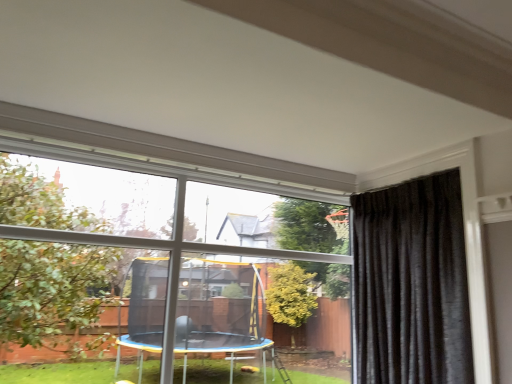
Question: From a real-world perspective, is black velvet curtain at right positioned above or below clear glass window at center?

Choices:
 (A) below
 (B) above

Answer: (B)

Question: In the image, is black velvet curtain at right positioned in front of or behind clear glass window at center?

Choices:
 (A) behind
 (B) front

Answer: (A)

Question: Considering the positions of black velvet curtain at right and clear glass window at center in the image, is black velvet curtain at right bigger or smaller than clear glass window at center?

Choices:
 (A) big
 (B) small

Answer: (B)

Question: In the image, is clear glass window at center positioned in front of or behind black velvet curtain at right?

Choices:
 (A) front
 (B) behind

Answer: (A)

Question: Visually, is clear glass window at center positioned to the left or to the right of black velvet curtain at right?

Choices:
 (A) left
 (B) right

Answer: (A)

Question: Based on their sizes in the image, would you say clear glass window at center is bigger or smaller than black velvet curtain at right?

Choices:
 (A) small
 (B) big

Answer: (B)

Question: From a real-world perspective, is clear glass window at center above or below black velvet curtain at right?

Choices:
 (A) below
 (B) above

Answer: (A)